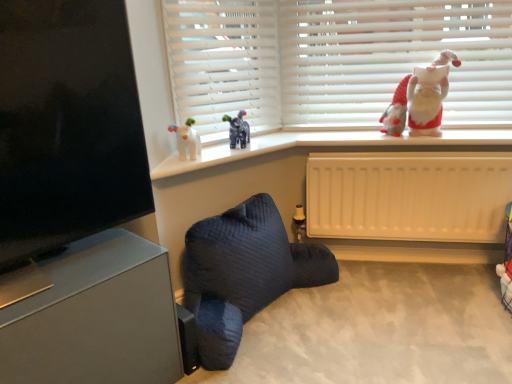
Find the location of `dark blue quilted bean bag chair at lower center`. dark blue quilted bean bag chair at lower center is located at coordinates (243, 273).

I want to click on white matte blinds at upper center, so tap(333, 60).

What do you see at coordinates (224, 63) in the screenshot? The height and width of the screenshot is (384, 512). I see `white matte blinds at upper center` at bounding box center [224, 63].

Measure the distance between point (286, 143) and camera.

The depth of point (286, 143) is 6.18 feet.

Locate an element on the screen. This screenshot has width=512, height=384. white plastic radiator at lower center is located at coordinates (409, 196).

Is white ceramic santa at upper right facing away from white plastic window sill at upper center?

white ceramic santa at upper right does not have its back to white plastic window sill at upper center.

Do you think white ceramic santa at upper right is within white plastic window sill at upper center, or outside of it?

white ceramic santa at upper right is outside white plastic window sill at upper center.

Is white ceramic santa at upper right beside white plastic window sill at upper center?

white ceramic santa at upper right is not next to white plastic window sill at upper center, and they're not touching.

Does black matte screen at upper left have a smaller size compared to matte gray speaker at lower left?

Yes.

From the image's perspective, is black matte screen at upper left above or below matte gray speaker at lower left?

Based on their image positions, black matte screen at upper left is located above matte gray speaker at lower left.

Is black matte screen at upper left inside the boundaries of matte gray speaker at lower left, or outside?

black matte screen at upper left is spatially situated outside matte gray speaker at lower left.

How much distance is there between black matte screen at upper left and matte gray speaker at lower left?

They are 12.01 inches apart.

Considering the positions of points (264, 16) and (67, 257), is point (264, 16) closer to camera compared to point (67, 257)?

That is False.

From the image's perspective, is white matte blinds at upper center located above or below matte gray speaker at lower left?

From the image's perspective, white matte blinds at upper center appears above matte gray speaker at lower left.

The width and height of the screenshot is (512, 384). I want to click on curtain behind the matte gray speaker at lower left, so click(x=224, y=63).

How far apart are white ceramic santa at upper right and matte gray speaker at lower left?

A distance of 4.61 feet exists between white ceramic santa at upper right and matte gray speaker at lower left.

Considering the points (424, 106) and (100, 283), which point is behind, point (424, 106) or point (100, 283)?

Point (424, 106)

Which is in front, white ceramic santa at upper right or matte gray speaker at lower left?

matte gray speaker at lower left is closer to the camera.

Where is `furniture below the white ceramic santa at upper right (from the image's perspective)`? This screenshot has height=384, width=512. furniture below the white ceramic santa at upper right (from the image's perspective) is located at coordinates (96, 317).

From a real-world perspective, is white matte blinds at upper center above or below white ceramic santa at upper right?

From a real-world perspective, white matte blinds at upper center is physically above white ceramic santa at upper right.

Who is shorter, white matte blinds at upper center or white ceramic santa at upper right?

white ceramic santa at upper right.

Who is bigger, white matte blinds at upper center or white ceramic santa at upper right?

white matte blinds at upper center.

Does white plastic window sill at upper center touch matte gray speaker at lower left?

No, white plastic window sill at upper center is not next to matte gray speaker at lower left.

From the image's perspective, does white plastic window sill at upper center appear higher than matte gray speaker at lower left?

Indeed, from the image's perspective, white plastic window sill at upper center is shown above matte gray speaker at lower left.

Which is in front, point (295, 138) or point (172, 317)?

The point (172, 317) is closer to the camera.

Measure the distance from white plastic window sill at upper center to matte gray speaker at lower left.

white plastic window sill at upper center is 23.83 inches from matte gray speaker at lower left.

I want to click on window sill behind the black matte screen at upper left, so click(x=321, y=145).

Is black matte screen at upper left placed right next to white plastic window sill at upper center?

black matte screen at upper left and white plastic window sill at upper center are clearly separated.

Looking at the image, does black matte screen at upper left seem bigger or smaller compared to white plastic window sill at upper center?

Clearly, black matte screen at upper left is larger in size than white plastic window sill at upper center.

Does black matte screen at upper left come in front of white plastic window sill at upper center?

Yes.

Identify the location of window sill that is on the left side of white ceramic santa at upper right. Image resolution: width=512 pixels, height=384 pixels. (321, 145).

Find the location of a particular element. window screen above the matte gray speaker at lower left (from a real-world perspective) is located at coordinates (67, 125).

Considering their positions, is black matte screen at upper left positioned further to matte gray speaker at lower left than white ceramic santa at upper right?

Among the two, white ceramic santa at upper right is located further to matte gray speaker at lower left.

From the image, which object appears to be farther from matte gray speaker at lower left, white matte blinds at upper center or white plastic window sill at upper center?

white matte blinds at upper center is positioned further to the anchor matte gray speaker at lower left.

Looking at the image, which one is located further to white matte blinds at upper center, white plastic window sill at upper center or black matte screen at upper left?

black matte screen at upper left.

Estimate the real-world distances between objects in this image. Which object is closer to white plastic window sill at upper center, matte gray speaker at lower left or dark blue quilted bean bag chair at lower center?

Based on the image, dark blue quilted bean bag chair at lower center appears to be nearer to white plastic window sill at upper center.

Estimate the real-world distances between objects in this image. Which object is further from white matte blinds at upper center, black matte screen at upper left or matte gray speaker at lower left?

matte gray speaker at lower left.

Considering their positions, is white ceramic santa at upper right positioned further to black matte screen at upper left than matte gray speaker at lower left?

Based on the image, white ceramic santa at upper right appears to be further to black matte screen at upper left.

From the image, which object appears to be farther from white matte blinds at upper center, white plastic window sill at upper center or white ceramic santa at upper right?

The object further to white matte blinds at upper center is white ceramic santa at upper right.

When comparing their distances from matte gray speaker at lower left, does white matte blinds at upper center or dark blue quilted bean bag chair at lower center seem closer?

Based on the image, dark blue quilted bean bag chair at lower center appears to be nearer to matte gray speaker at lower left.

Where is `window blind between white matte blinds at upper center and white ceramic santa at upper right`? This screenshot has width=512, height=384. window blind between white matte blinds at upper center and white ceramic santa at upper right is located at coordinates (333, 60).

The width and height of the screenshot is (512, 384). What are the coordinates of `window screen between matte gray speaker at lower left and white plastic window sill at upper center from left to right` in the screenshot? It's located at (67, 125).

Where is `bean bag chair between matte gray speaker at lower left and white matte blinds at upper center in the horizontal direction`? The image size is (512, 384). bean bag chair between matte gray speaker at lower left and white matte blinds at upper center in the horizontal direction is located at coordinates (243, 273).

The height and width of the screenshot is (384, 512). I want to click on bean bag chair between matte gray speaker at lower left and white plastic window sill at upper center from left to right, so click(x=243, y=273).